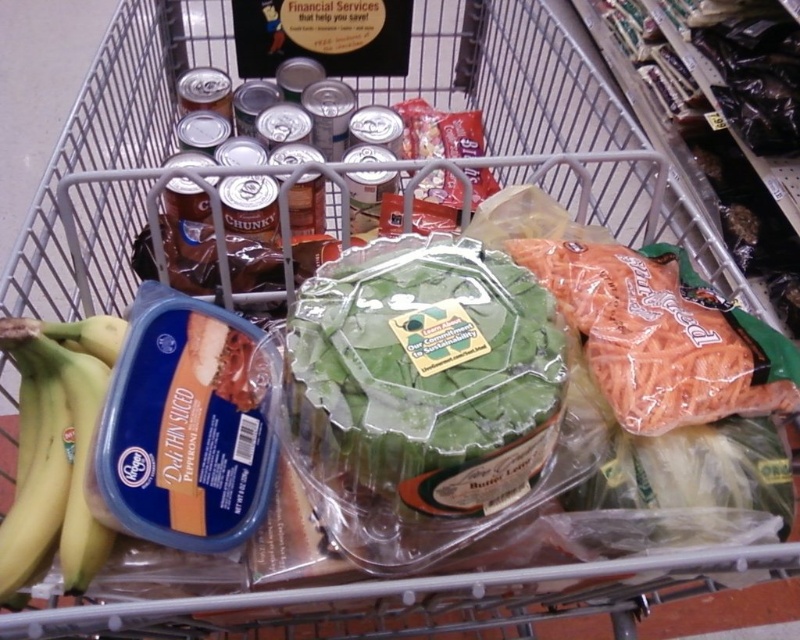
You are a customer in a supermarket and want to grab the green leafy lettuce at center and the yellow matte bananas at left from the shopping cart. Which item should you reach for first to get the one closer to you?

The green leafy lettuce at center is in front of the yellow matte bananas at left, so you should reach for the green leafy lettuce at center first as it is closer to you.

You are organizing groceries in a shopping cart. You have a green leafy lettuce at center and yellow matte bananas at left. If you want to access the bananas, do you need to move the lettuce first?

Yes, because the green leafy lettuce at center is positioned over yellow matte bananas at left, so you need to move the lettuce to reach the bananas.

You are a grocery store employee who needs to restock items in the cart. The lettuce must be placed in a refrigerated section that requires items to be at least 10 inches apart for proper airflow. Can the yellow matte bananas at left and green leafy lettuce at center be placed together in this section?

The distance between the green leafy lettuce at center and yellow matte bananas at left is 9.53 inches, which is less than the required 10 inches. Therefore, they cannot be placed together in the refrigerated section.